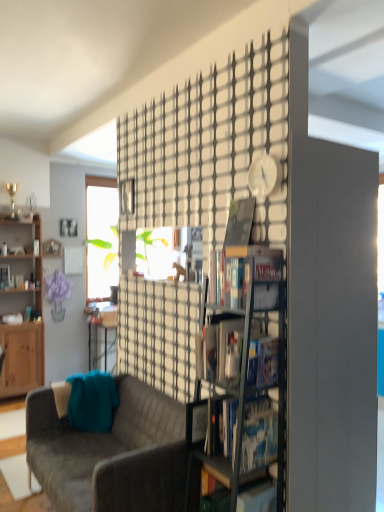
Question: Should I look upward or downward to see matte black bookshelf at center, acting as the third book starting from the front?

Choices:
 (A) up
 (B) down

Answer: (B)

Question: Is matte black bookshelf at center, which ranks as the 3th book in bottom-to-top order, bigger than clear glass bookshelf at center?

Choices:
 (A) yes
 (B) no

Answer: (B)

Question: From a real-world perspective, is matte black bookshelf at center, the fourth book positioned from the top, over clear glass bookshelf at center?

Choices:
 (A) yes
 (B) no

Answer: (A)

Question: Does matte black bookshelf at center, acting as the third book starting from the front, have a lesser height compared to clear glass bookshelf at center?

Choices:
 (A) yes
 (B) no

Answer: (A)

Question: Considering the relative sizes of matte black bookshelf at center, the fourth book positioned from the top, and clear glass bookshelf at center in the image provided, is matte black bookshelf at center, the fourth book positioned from the top, thinner than clear glass bookshelf at center?

Choices:
 (A) yes
 (B) no

Answer: (A)

Question: Is matte black bookshelf at center, which ranks as the 3th book in bottom-to-top order, to the right of clear glass bookshelf at center from the viewer's perspective?

Choices:
 (A) yes
 (B) no

Answer: (A)

Question: Is matte black bookshelf at center, the fourth book from the back, oriented towards clear glass bookshelf at center?

Choices:
 (A) no
 (B) yes

Answer: (B)

Question: Can you confirm if hardcover book at center, the 6th book positioned from the top, is smaller than matte black magazine at center?

Choices:
 (A) no
 (B) yes

Answer: (A)

Question: Is hardcover book at center, the fifth book when ordered from right to left, at the left side of matte black magazine at center?

Choices:
 (A) yes
 (B) no

Answer: (B)

Question: Is hardcover book at center, placed as the 1th book when sorted from bottom to top, placed right next to matte black magazine at center?

Choices:
 (A) no
 (B) yes

Answer: (A)

Question: Is the depth of hardcover book at center, the second book positioned from the left, less than that of matte black magazine at center?

Choices:
 (A) yes
 (B) no

Answer: (A)

Question: From the image's perspective, is hardcover book at center, the 1th book when ordered from front to back, on matte black magazine at center?

Choices:
 (A) yes
 (B) no

Answer: (B)

Question: From a real-world perspective, is hardcover book at center, the fifth book when ordered from right to left, physically above matte black magazine at center?

Choices:
 (A) no
 (B) yes

Answer: (A)

Question: Is hardcover book at center, the 1th book when ordered from front to back, closer to camera compared to hardcover book at center, placed as the 4th book when sorted from right to left?

Choices:
 (A) no
 (B) yes

Answer: (B)